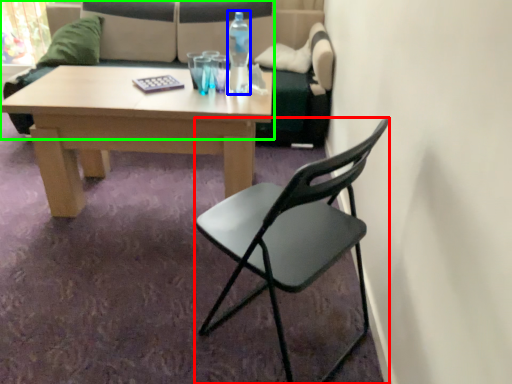
Question: Based on their relative distances, which object is nearer to chair (highlighted by a red box)? Choose from bottle (highlighted by a blue box) and studio couch (highlighted by a green box).

Choices:
 (A) bottle
 (B) studio couch

Answer: (A)